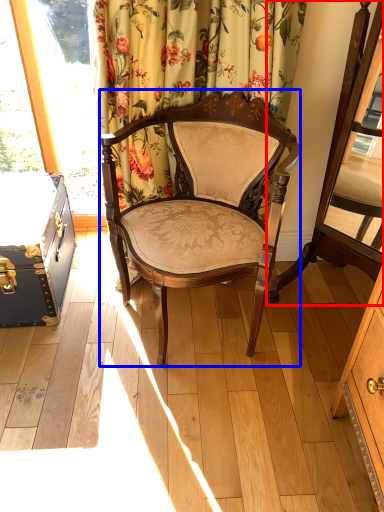
Question: Which of the following is the closest to the observer, swivel chair (highlighted by a red box) or chair (highlighted by a blue box)?

Choices:
 (A) swivel chair
 (B) chair

Answer: (A)